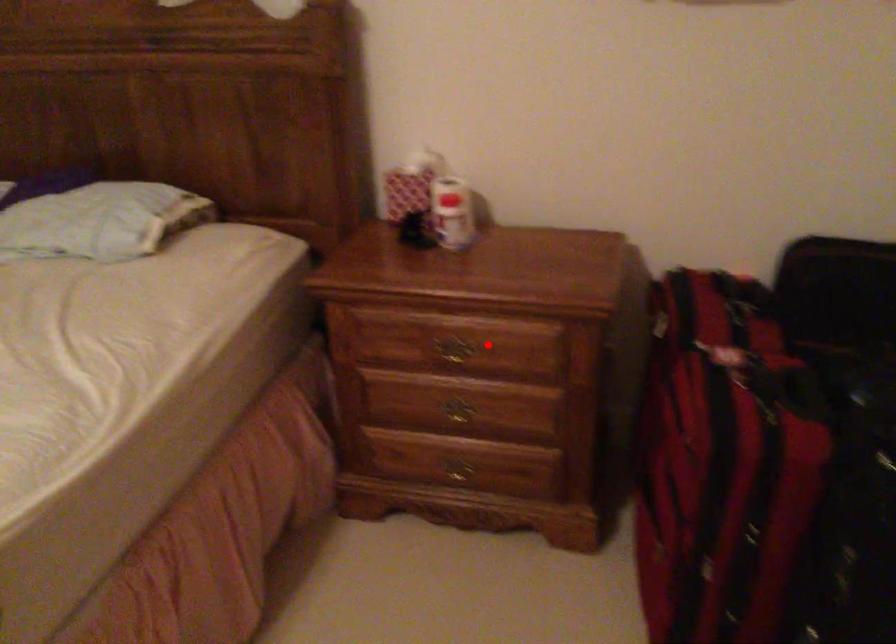
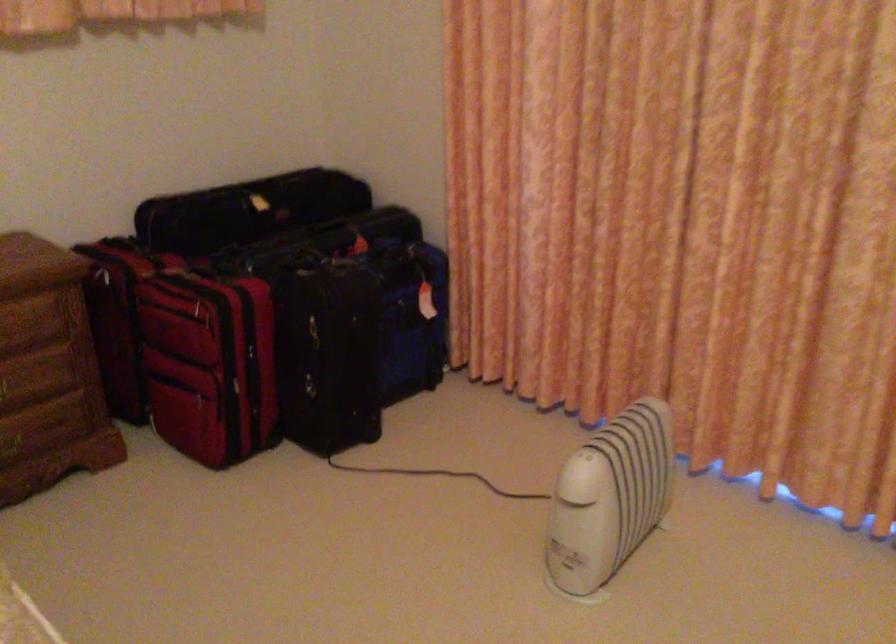
Question: I am providing you with two images of the same scene from different viewpoints. Image1 has a red point marked. In image2, the corresponding 3D location appears at what relative position? Reply with the corresponding letter.

Choices:
 (A) Closer
 (B) Farther

Answer: (B)